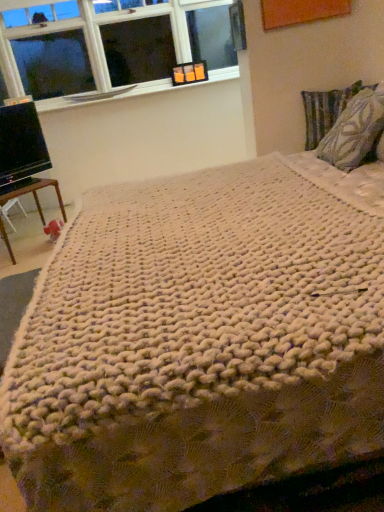
Question: From the image's perspective, does white textured window sill at upper left appear lower than clear glass window at upper left?

Choices:
 (A) no
 (B) yes

Answer: (B)

Question: Is white textured window sill at upper left outside of clear glass window at upper left?

Choices:
 (A) yes
 (B) no

Answer: (A)

Question: Is white textured window sill at upper left wider than clear glass window at upper left?

Choices:
 (A) yes
 (B) no

Answer: (A)

Question: Does white textured window sill at upper left lie behind clear glass window at upper left?

Choices:
 (A) yes
 (B) no

Answer: (A)

Question: Is white textured window sill at upper left bigger than clear glass window at upper left?

Choices:
 (A) yes
 (B) no

Answer: (B)

Question: From the image's perspective, does white textured window sill at upper left appear higher than clear glass window at upper left?

Choices:
 (A) no
 (B) yes

Answer: (A)

Question: Are textured fabric pillow at upper right, placed as the 2th pillow when sorted from front to back, and white textured window sill at upper left beside each other?

Choices:
 (A) no
 (B) yes

Answer: (A)

Question: Considering the relative sizes of textured fabric pillow at upper right, placed as the 2th pillow when sorted from front to back, and white textured window sill at upper left in the image provided, is textured fabric pillow at upper right, placed as the 2th pillow when sorted from front to back, bigger than white textured window sill at upper left?

Choices:
 (A) no
 (B) yes

Answer: (B)

Question: Considering the relative sizes of textured fabric pillow at upper right, arranged as the 1th pillow when viewed from the back, and white textured window sill at upper left in the image provided, is textured fabric pillow at upper right, arranged as the 1th pillow when viewed from the back, smaller than white textured window sill at upper left?

Choices:
 (A) no
 (B) yes

Answer: (A)

Question: Is white textured window sill at upper left located within textured fabric pillow at upper right, placed as the 2th pillow when sorted from front to back?

Choices:
 (A) yes
 (B) no

Answer: (B)

Question: Is the depth of textured fabric pillow at upper right, placed as the 2th pillow when sorted from front to back, less than that of white textured window sill at upper left?

Choices:
 (A) yes
 (B) no

Answer: (A)

Question: Is textured fabric pillow at upper right, arranged as the 1th pillow when viewed from the back, not near white textured window sill at upper left?

Choices:
 (A) yes
 (B) no

Answer: (A)

Question: From a real-world perspective, is clear glass window at upper left located higher than brown wooden table at lower left?

Choices:
 (A) yes
 (B) no

Answer: (A)